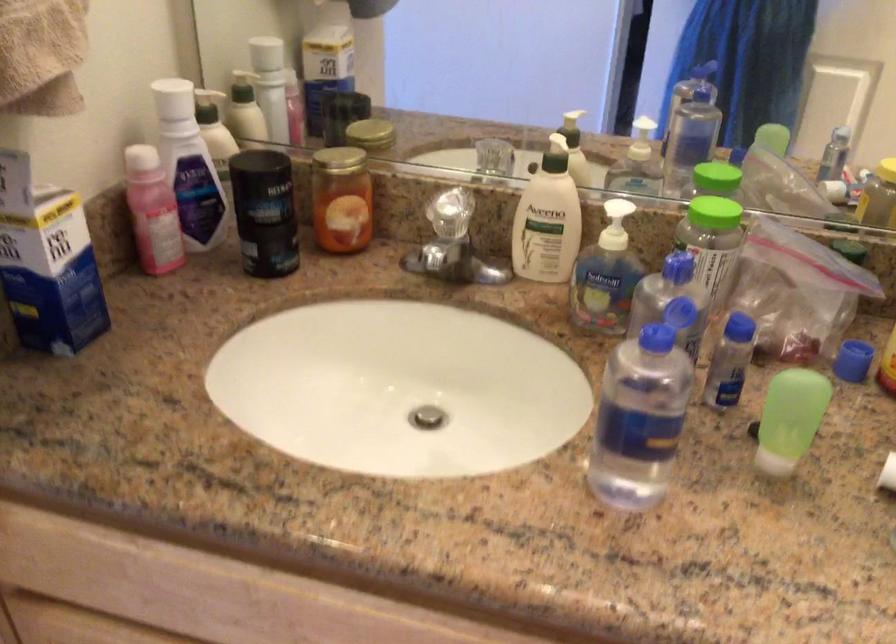
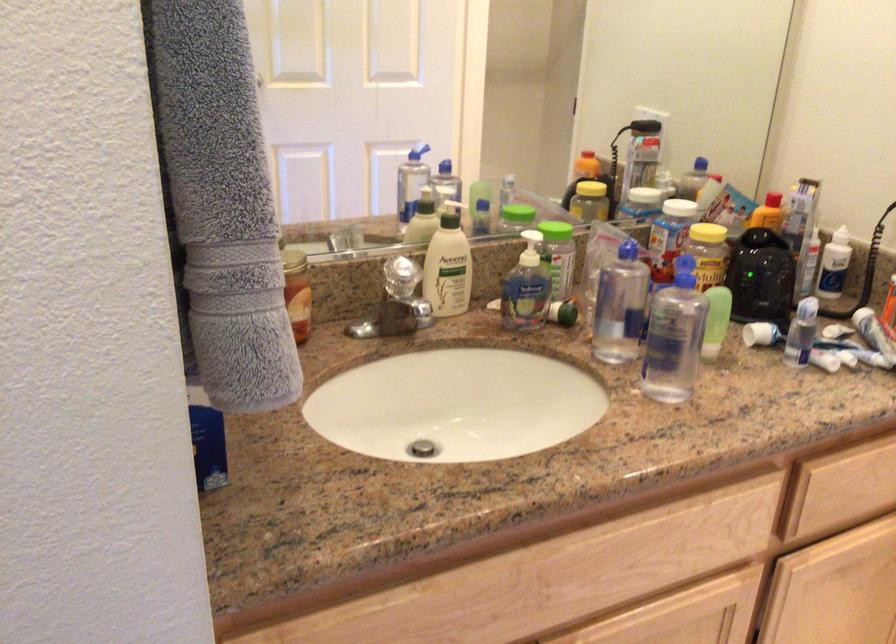
Question: I am providing you with two images of the same scene from different viewpoints. Which of the following objects are not visible in image2?

Choices:
 (A) yellow jar lid
 (B) blue bottle cap
 (C) cream chair sitting surface
 (D) pink bottle

Answer: (D)